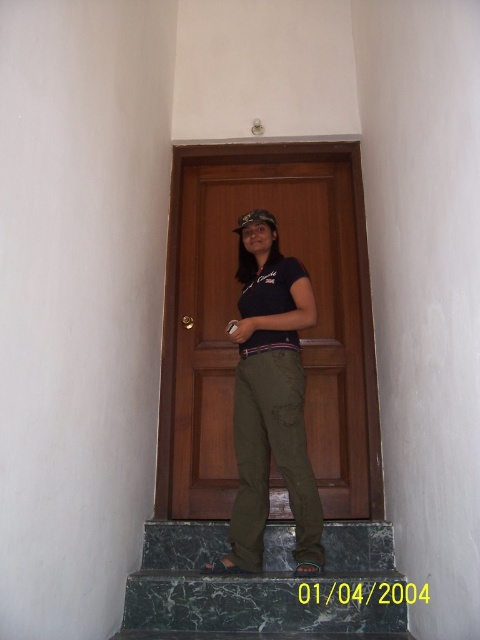
Question: Is green marble stairs at center above olive green pants at center?

Choices:
 (A) no
 (B) yes

Answer: (A)

Question: Does green marble stairs at center have a smaller size compared to olive green pants at center?

Choices:
 (A) yes
 (B) no

Answer: (A)

Question: Which point is farther to the camera?

Choices:
 (A) green marble stairs at center
 (B) olive green pants at center

Answer: (B)

Question: Which point is closer to the camera?

Choices:
 (A) (332, 516)
 (B) (263, 403)
 (C) (389, 621)

Answer: (C)

Question: Observing the image, what is the correct spatial positioning of brown wooden door at center in reference to olive green pants at center?

Choices:
 (A) below
 (B) above

Answer: (B)

Question: Which object is closer to the camera taking this photo?

Choices:
 (A) brown wooden door at center
 (B) olive green pants at center

Answer: (B)